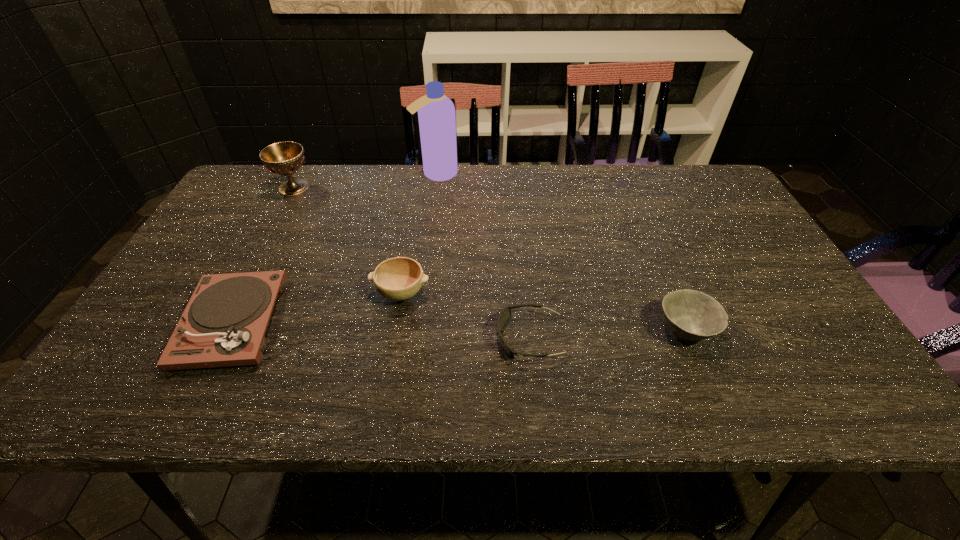
The image size is (960, 540). In order to click on vacant space located 0.400m on the back of the right bowl in this screenshot , I will do [634, 206].

Locate an element on the screen. This screenshot has height=540, width=960. free space located on the right of the phonograph_record is located at coordinates (399, 322).

Identify the location of free region located on the lenses of the shortest object. (317, 339).

Find the location of `vacant space located on the lenses of the shortest object`. vacant space located on the lenses of the shortest object is located at coordinates (368, 339).

At what (x,y) coordinates should I click in order to perform the action: click on vacant space located 0.090m on the lenses of the shortest object. Please return your answer as a coordinate pair (x, y). This screenshot has height=540, width=960. Looking at the image, I should click on (455, 339).

Locate an element on the screen. This screenshot has height=540, width=960. shampoo that is at the far edge is located at coordinates (436, 113).

Where is `chalice that is at the far edge`? This screenshot has height=540, width=960. chalice that is at the far edge is located at coordinates (284, 158).

The image size is (960, 540). In order to click on object located in the near edge section of the desktop in this screenshot , I will do `click(224, 323)`.

At what (x,y) coordinates should I click in order to perform the action: click on chalice at the left edge. Please return your answer as a coordinate pair (x, y). The height and width of the screenshot is (540, 960). Looking at the image, I should click on (284, 158).

Locate an element on the screen. This screenshot has height=540, width=960. phonograph_record present at the left edge is located at coordinates (224, 323).